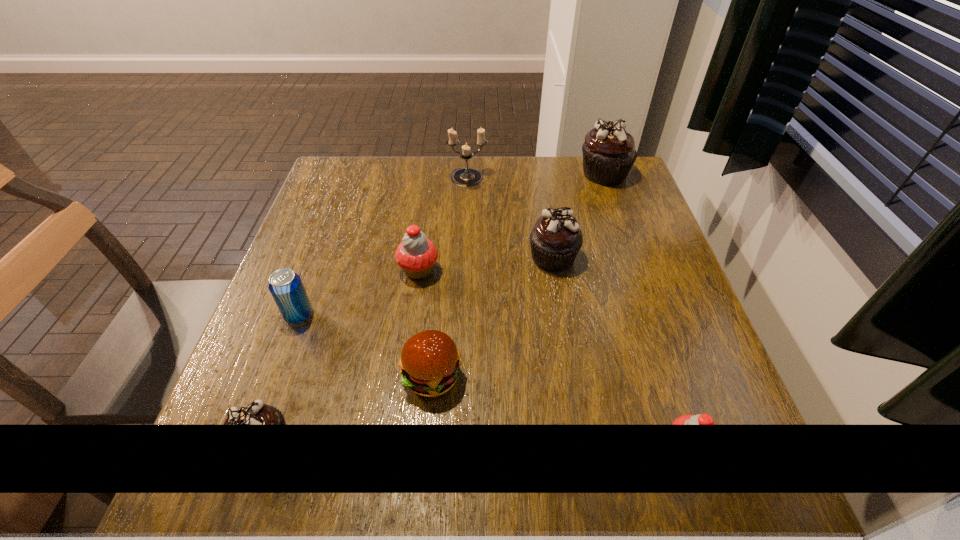
This screenshot has width=960, height=540. In order to click on brown hamburger in this screenshot , I will do (x=430, y=364).

Identify the location of the right red cupcake. (701, 419).

Locate an element on the screen. the nearer red cupcake is located at coordinates (701, 419).

This screenshot has width=960, height=540. Identify the location of the leftmost cupcake. (256, 413).

In order to click on the nearest brown cupcake in this screenshot , I will do `click(256, 413)`.

Where is `vacant point located on the front of the farthest brown cupcake`? The image size is (960, 540). vacant point located on the front of the farthest brown cupcake is located at coordinates (640, 274).

I want to click on free space located on the right of the candle holder, so click(x=524, y=179).

Identify the location of free point located 0.350m on the right of the fourth cupcake from right to left. This screenshot has width=960, height=540. (599, 270).

Locate an element on the screen. The image size is (960, 540). vacant space located on the front of the second smallest brown cupcake is located at coordinates (570, 357).

This screenshot has width=960, height=540. Identify the location of vacant space located on the front of the beer can. (238, 481).